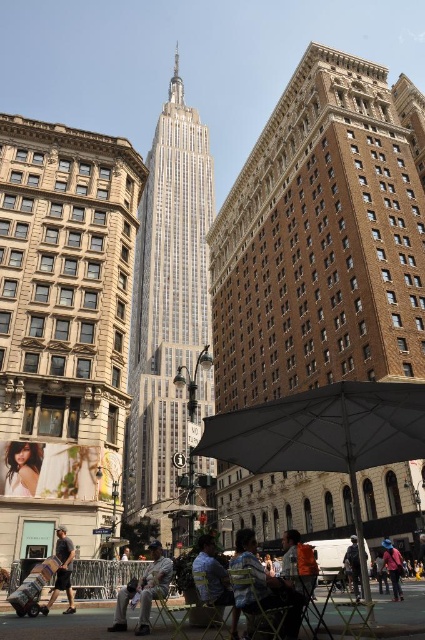
You are a photographer standing at the edge of the street. You want to take a photo of the denim jacket at lower right without the gray fabric umbrella at lower center blocking it. Is this possible from your current position?

The gray fabric umbrella at lower center is in front of the denim jacket at lower right, so it would block the view. To capture the denim jacket at lower right without obstruction, you would need to move to a position where the umbrella is no longer between you and the jacket.

Consider the image. You are a photographer standing at the edge of the street in the urban scene. You want to take a photo of the Empire State Building in the background without any obstructions. There is a person wearing blue denim jeans at center in the way. Where should you move to avoid them?

Since the blue denim jeans at center is located at point 0.887 on the x axis and 0.925 on the y axis, you should move to the left or right along the street to position yourself outside of their coordinates to avoid obstruction.